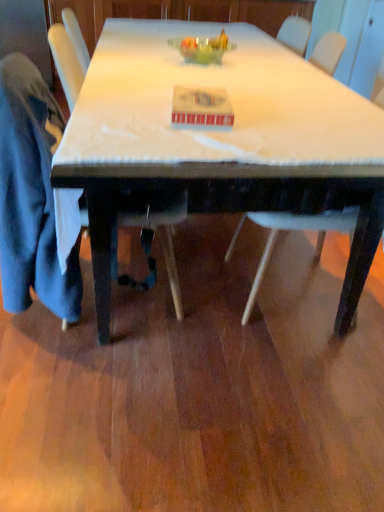
Question: Is white plastic chair at lower right, positioned as the 1th chair in right-to-left order, surrounded by velvet blue jacket at left, the 2th chair from the right?

Choices:
 (A) no
 (B) yes

Answer: (A)

Question: Does velvet blue jacket at left, the 2th chair from the right, turn towards white plastic chair at lower right, positioned as the 1th chair in right-to-left order?

Choices:
 (A) no
 (B) yes

Answer: (B)

Question: Is velvet blue jacket at left, the 2th chair from the right, placed right next to white plastic chair at lower right, positioned as the 1th chair in right-to-left order?

Choices:
 (A) yes
 (B) no

Answer: (B)

Question: Can you confirm if velvet blue jacket at left, arranged as the first chair when viewed from the left, is bigger than white plastic chair at lower right, arranged as the 2th chair when viewed from the left?

Choices:
 (A) yes
 (B) no

Answer: (A)

Question: Can you confirm if velvet blue jacket at left, arranged as the first chair when viewed from the left, is wider than white plastic chair at lower right, positioned as the 1th chair in right-to-left order?

Choices:
 (A) no
 (B) yes

Answer: (A)

Question: Is velvet blue jacket at left, arranged as the first chair when viewed from the left, positioned behind white plastic chair at lower right, positioned as the 1th chair in right-to-left order?

Choices:
 (A) no
 (B) yes

Answer: (A)

Question: Is white plastic chair at lower right, positioned as the 1th chair in right-to-left order, next to translucent glass bowl at center and touching it?

Choices:
 (A) yes
 (B) no

Answer: (B)

Question: Is white plastic chair at lower right, arranged as the 2th chair when viewed from the left, at the right side of translucent glass bowl at center?

Choices:
 (A) no
 (B) yes

Answer: (B)

Question: Is white plastic chair at lower right, positioned as the 1th chair in right-to-left order, facing away from translucent glass bowl at center?

Choices:
 (A) no
 (B) yes

Answer: (A)

Question: Can you confirm if white plastic chair at lower right, arranged as the 2th chair when viewed from the left, is taller than translucent glass bowl at center?

Choices:
 (A) no
 (B) yes

Answer: (B)

Question: Is white plastic chair at lower right, arranged as the 2th chair when viewed from the left, to the left of translucent glass bowl at center from the viewer's perspective?

Choices:
 (A) yes
 (B) no

Answer: (B)

Question: Would you say white plastic chair at lower right, arranged as the 2th chair when viewed from the left, contains translucent glass bowl at center?

Choices:
 (A) yes
 (B) no

Answer: (B)

Question: Does blue cotton robe at left have a lesser height compared to translucent glass bowl at center?

Choices:
 (A) yes
 (B) no

Answer: (B)